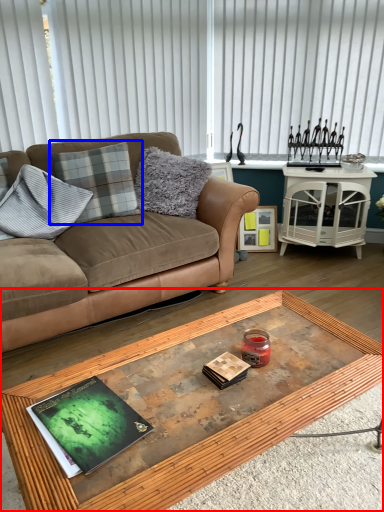
Question: Which point is closer to the camera, coffee table (highlighted by a red box) or pillow (highlighted by a blue box)?

Choices:
 (A) coffee table
 (B) pillow

Answer: (A)